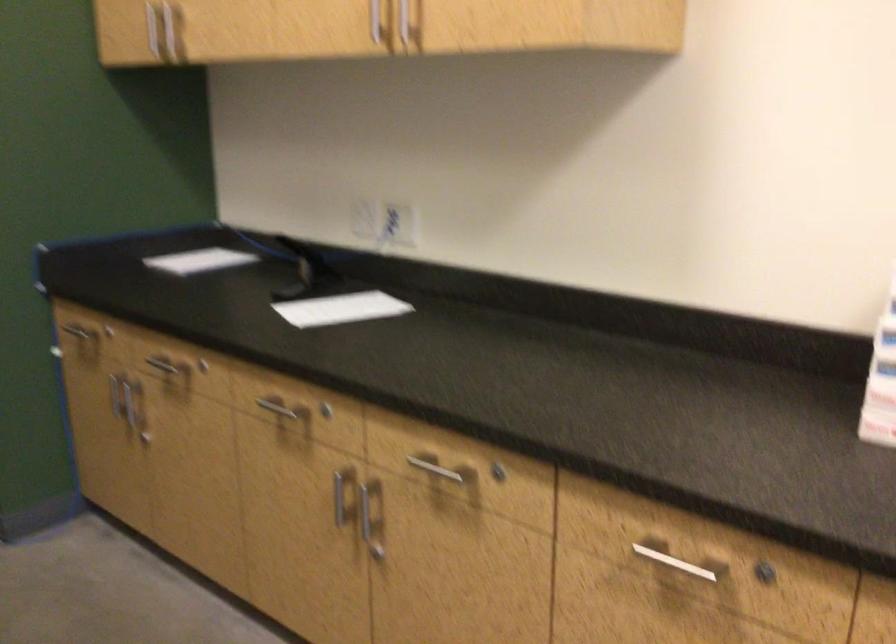
Question: The first image is from the beginning of the video and the second image is from the end. How did the camera likely rotate when shooting the video?

Choices:
 (A) Left
 (B) Right
 (C) Up
 (D) Down

Answer: (B)